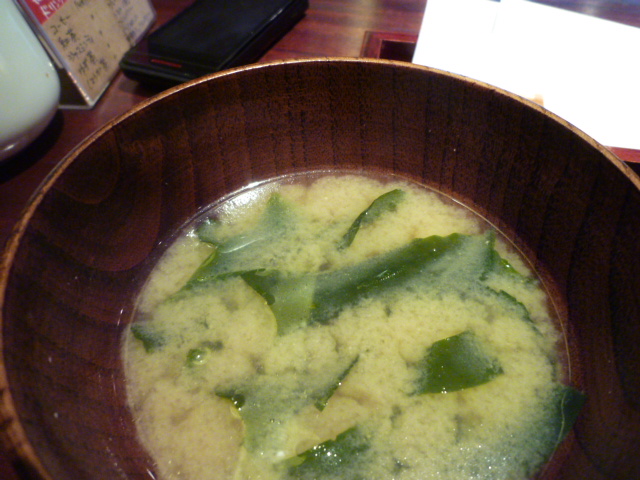
This screenshot has width=640, height=480. Find the location of `mug`. mug is located at coordinates (49, 106).